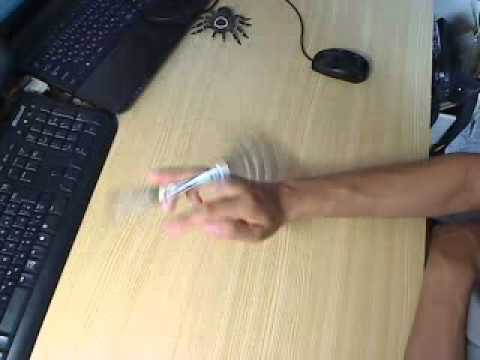
Locate an element on the screen. Image resolution: width=480 pixels, height=360 pixels. computer monitor is located at coordinates (10, 7).